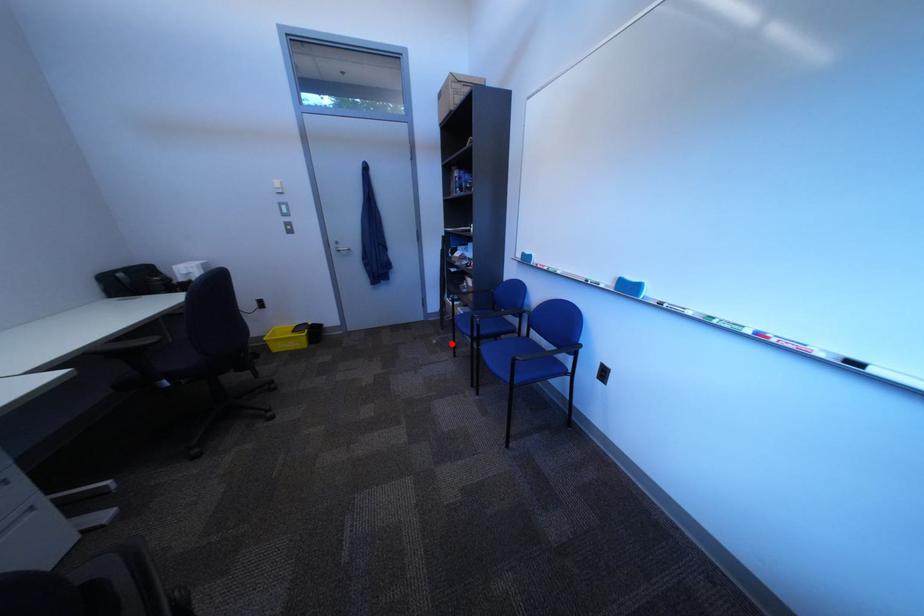
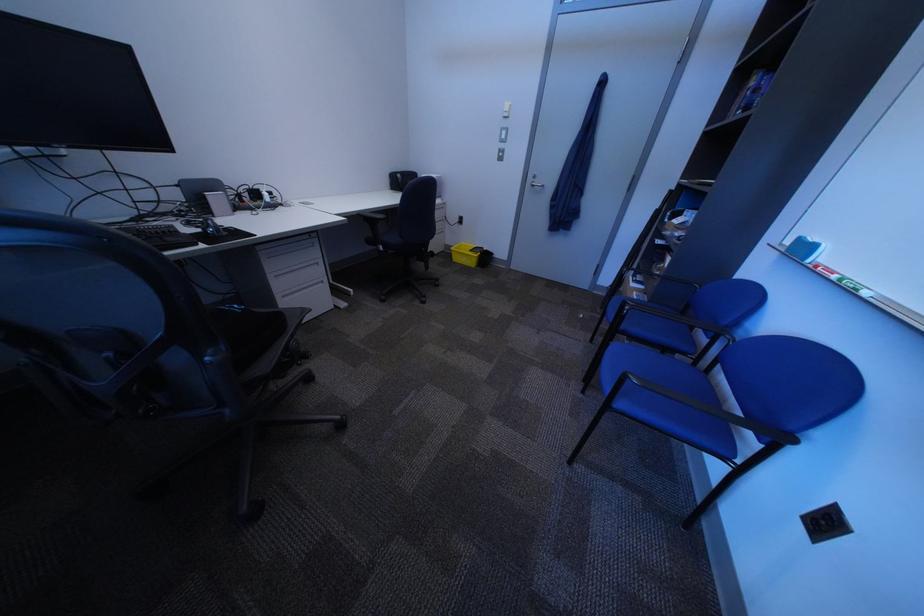
Locate, in the second image, the point that corresponds to the highlighted location in the first image.

(599, 318)